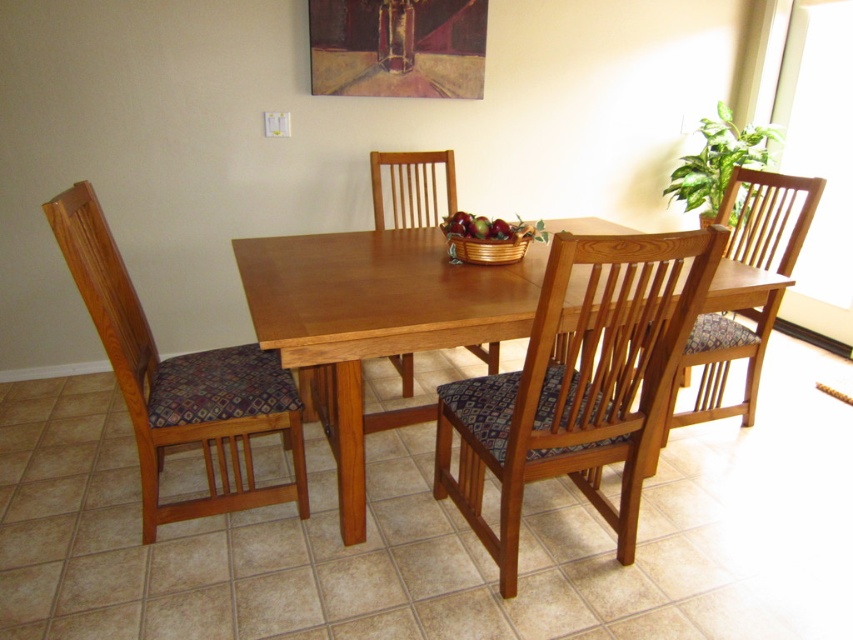
Who is positioned more to the left, light brown wood table at center or wooden chair at center?

Positioned to the left is wooden chair at center.

You are a GUI agent. You are given a task and a screenshot of the screen. Output one action in this format:
    pyautogui.click(x=<x>, y=<y>)
    Task: Click on the light brown wood table at center
    
    Given the screenshot: What is the action you would take?
    tap(372, 323)

Find the location of `light brown wood table at center`. light brown wood table at center is located at coordinates (372, 323).

From the picture: Is wooden chair with patterned cushion at left closer to the viewer compared to wooden chair at center?

Yes.

Is point (109, 257) closer to camera compared to point (437, 152)?

Yes, it is in front of point (437, 152).

Is point (215, 436) positioned before point (498, 355)?

That is True.

This screenshot has height=640, width=853. In order to click on wooden chair with patterned cushion at left in this screenshot , I will do `click(178, 381)`.

From the picture: Is wooden chair with patterned cushion at left to the left of oil paint canvas at upper center from the viewer's perspective?

Yes, wooden chair with patterned cushion at left is to the left of oil paint canvas at upper center.

Who is higher up, wooden chair with patterned cushion at left or oil paint canvas at upper center?

Positioned higher is oil paint canvas at upper center.

Locate an element on the screen. wooden chair with patterned cushion at left is located at coordinates (178, 381).